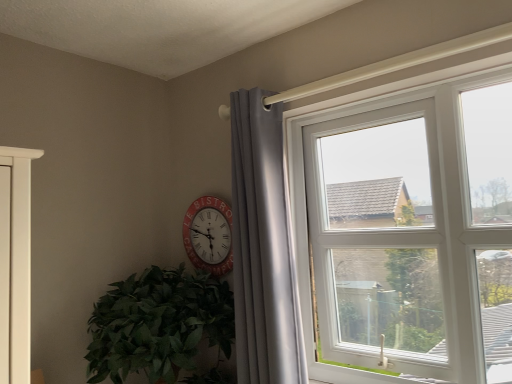
Question: Is point (287, 369) closer or farther from the camera than point (202, 198)?

Choices:
 (A) farther
 (B) closer

Answer: (B)

Question: From the image's perspective, relative to red plastic clock at center, is matte gray curtain at upper right above or below?

Choices:
 (A) below
 (B) above

Answer: (B)

Question: Estimate the real-world distances between objects in this image. Which object is farther from the green leafy plant at lower left?

Choices:
 (A) red plastic clock at center
 (B) white plastic window at upper right
 (C) matte gray curtain at upper right

Answer: (B)

Question: Which is nearer to the red plastic clock at center?

Choices:
 (A) green leafy plant at lower left
 (B) white plastic window at upper right
 (C) matte gray curtain at upper right

Answer: (A)